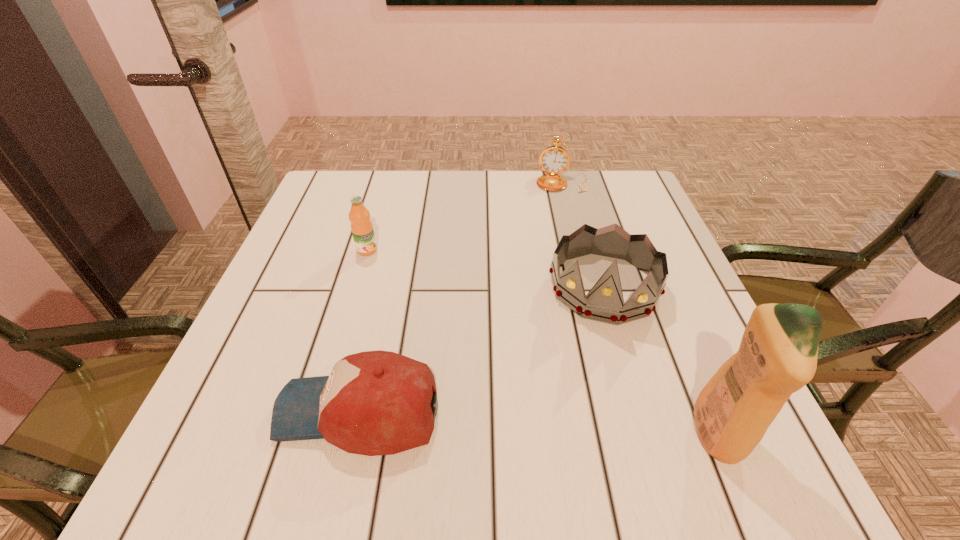
Locate an element on the screen. detergent that is positioned at the right edge is located at coordinates (777, 356).

This screenshot has width=960, height=540. In order to click on tiara at the right edge in this screenshot , I will do `click(604, 302)`.

Where is `pocket watch present at the right edge`? The height and width of the screenshot is (540, 960). pocket watch present at the right edge is located at coordinates (554, 160).

I want to click on object present at the near left corner, so click(374, 403).

The image size is (960, 540). I want to click on object present at the far right corner, so click(554, 160).

This screenshot has width=960, height=540. Find the location of `object that is at the near right corner`. object that is at the near right corner is located at coordinates (777, 356).

Identify the location of vacant space at the far edge of the desktop. Image resolution: width=960 pixels, height=540 pixels. (516, 207).

You are a GUI agent. You are given a task and a screenshot of the screen. Output one action in this format:
    pyautogui.click(x=<x>, y=<y>)
    Task: Click on the free region at the near edge of the desktop
    Image resolution: width=960 pixels, height=540 pixels.
    Given the screenshot: What is the action you would take?
    pyautogui.click(x=543, y=386)

This screenshot has height=540, width=960. Find the location of `free location at the left edge of the desktop`. free location at the left edge of the desktop is located at coordinates (316, 362).

In order to click on free space at the right edge in this screenshot , I will do `click(697, 325)`.